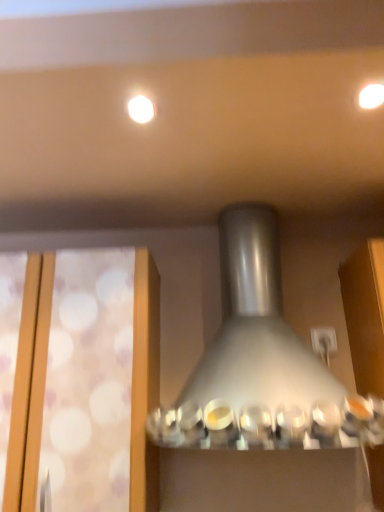
Question: Considering the relative sizes of satin silver lamp at center and white glossy light fixture at upper center, the second lighting in the right-to-left sequence, in the image provided, is satin silver lamp at center wider than white glossy light fixture at upper center, the second lighting in the right-to-left sequence,?

Choices:
 (A) no
 (B) yes

Answer: (B)

Question: Is white glossy light fixture at upper center, the second lighting in the right-to-left sequence, a part of satin silver lamp at center?

Choices:
 (A) yes
 (B) no

Answer: (B)

Question: From the image's perspective, is satin silver lamp at center located beneath white glossy light fixture at upper center, which is the 1th lighting from left to right?

Choices:
 (A) no
 (B) yes

Answer: (B)

Question: Can you confirm if satin silver lamp at center is shorter than white glossy light fixture at upper center, the second lighting in the right-to-left sequence?

Choices:
 (A) yes
 (B) no

Answer: (B)

Question: Considering the relative sizes of satin silver lamp at center and white glossy light fixture at upper center, which is the 1th lighting from left to right, in the image provided, is satin silver lamp at center taller than white glossy light fixture at upper center, which is the 1th lighting from left to right,?

Choices:
 (A) no
 (B) yes

Answer: (B)

Question: Does satin silver lamp at center come behind white glossy light fixture at upper center, which is the 1th lighting from left to right?

Choices:
 (A) no
 (B) yes

Answer: (A)

Question: Is satin silver lamp at center outside of matte white light at upper right, the second lighting from the left?

Choices:
 (A) yes
 (B) no

Answer: (A)

Question: Is satin silver lamp at center far from matte white light at upper right, the second lighting from the left?

Choices:
 (A) yes
 (B) no

Answer: (B)

Question: Is satin silver lamp at center facing away from matte white light at upper right, the second lighting from the left?

Choices:
 (A) yes
 (B) no

Answer: (B)

Question: Can you confirm if satin silver lamp at center is positioned to the left of matte white light at upper right, the second lighting from the left?

Choices:
 (A) no
 (B) yes

Answer: (B)

Question: Does satin silver lamp at center have a greater width compared to matte white light at upper right, the second lighting from the left?

Choices:
 (A) yes
 (B) no

Answer: (A)

Question: Does satin silver lamp at center touch matte white light at upper right, the second lighting from the left?

Choices:
 (A) no
 (B) yes

Answer: (A)

Question: Is white glossy light fixture at upper center, which is the 1th lighting from left to right, taller than satin silver lamp at center?

Choices:
 (A) yes
 (B) no

Answer: (B)